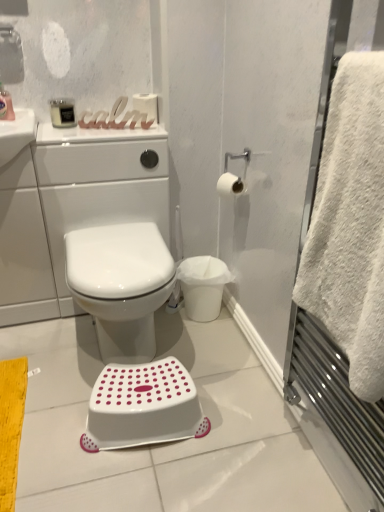
Question: Considering the relative positions of white matte toilet paper at upper right, the first toilet paper from the front, and white glossy toilet at center in the image provided, is white matte toilet paper at upper right, the first toilet paper from the front, in front of white glossy toilet at center?

Choices:
 (A) yes
 (B) no

Answer: (B)

Question: Does white matte toilet paper at upper right, the first toilet paper when ordered from right to left, have a lesser width compared to white glossy toilet at center?

Choices:
 (A) no
 (B) yes

Answer: (B)

Question: Does white matte toilet paper at upper right, arranged as the 2th toilet paper when viewed from the top, have a larger size compared to white glossy toilet at center?

Choices:
 (A) no
 (B) yes

Answer: (A)

Question: Is white matte toilet paper at upper right, the first toilet paper when ordered from right to left, placed right next to white glossy toilet at center?

Choices:
 (A) yes
 (B) no

Answer: (B)

Question: Is white matte toilet paper at upper right, arranged as the 2th toilet paper when viewed from the top, at the left side of white glossy toilet at center?

Choices:
 (A) yes
 (B) no

Answer: (B)

Question: Would you say matte black device at upper left, arranged as the 2th toiletry when viewed from the left, is to the left or to the right of white fluffy towel at right in the picture?

Choices:
 (A) right
 (B) left

Answer: (B)

Question: From their relative heights in the image, would you say matte black device at upper left, which is the first toiletry in right-to-left order, is taller or shorter than white fluffy towel at right?

Choices:
 (A) short
 (B) tall

Answer: (A)

Question: Is matte black device at upper left, arranged as the 2th toiletry when viewed from the left, situated inside white fluffy towel at right or outside?

Choices:
 (A) outside
 (B) inside

Answer: (A)

Question: From a real-world perspective, is matte black device at upper left, which is the first toiletry in right-to-left order, positioned above or below white fluffy towel at right?

Choices:
 (A) below
 (B) above

Answer: (B)

Question: Is point (216, 182) closer or farther from the camera than point (56, 122)?

Choices:
 (A) farther
 (B) closer

Answer: (A)

Question: In the image, is white matte toilet paper at upper right, which appears as the second toilet paper when viewed from the back, positioned in front of or behind matte black device at upper left, arranged as the 2th toiletry when viewed from the left?

Choices:
 (A) behind
 (B) front

Answer: (B)

Question: Considering the positions of white matte toilet paper at upper right, the first toilet paper from the front, and matte black device at upper left, arranged as the 2th toiletry when viewed from the left, in the image, is white matte toilet paper at upper right, the first toilet paper from the front, bigger or smaller than matte black device at upper left, arranged as the 2th toiletry when viewed from the left,?

Choices:
 (A) big
 (B) small

Answer: (A)

Question: Considering the relative positions of white matte toilet paper at upper right, which appears as the second toilet paper when viewed from the back, and matte black device at upper left, which is the first toiletry in right-to-left order, in the image provided, is white matte toilet paper at upper right, which appears as the second toilet paper when viewed from the back, to the left or to the right of matte black device at upper left, which is the first toiletry in right-to-left order,?

Choices:
 (A) right
 (B) left

Answer: (A)

Question: From a real-world perspective, is white glossy toilet at center positioned above or below white matte toilet paper at upper right, which appears as the second toilet paper when viewed from the back?

Choices:
 (A) above
 (B) below

Answer: (B)

Question: Visually, is white glossy toilet at center positioned to the left or to the right of white matte toilet paper at upper right, which appears as the second toilet paper when viewed from the back?

Choices:
 (A) right
 (B) left

Answer: (B)